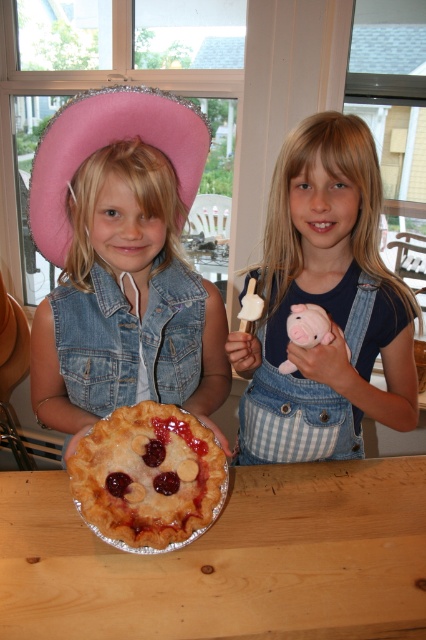
You are standing at the point with coordinates (x=325, y=305). Looking around, you see the denim overalls at center. What object is located exactly at your current position?

The denim overalls at center is located exactly at the point with coordinates (x=325, y=305).

You are standing in the room and want to grab the golden flaky pie at center. According to the spatial coordinates provided, where exactly should you look to find it?

The golden flaky pie at center is located at point (147, 477), so you should look towards those coordinates to find it.